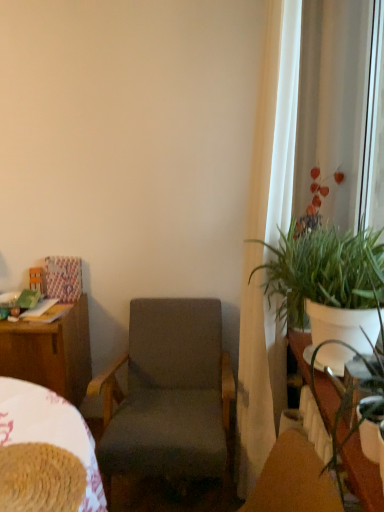
Question: Is dark gray fabric chair at center spatially inside wooden desk at left, or outside of it?

Choices:
 (A) inside
 (B) outside

Answer: (B)

Question: Does point (162, 388) appear closer or farther from the camera than point (46, 337)?

Choices:
 (A) closer
 (B) farther

Answer: (B)

Question: Estimate the real-world distances between objects in this image. Which object is farther from the dark gray fabric chair at center?

Choices:
 (A) white glossy table at right
 (B) wooden desk at left
 (C) woven fabric bed at lower left
 (D) green leafy plant at right
 (E) white sheer curtain at right

Answer: (A)

Question: Estimate the real-world distances between objects in this image. Which object is closer to the green leafy plant at right?

Choices:
 (A) dark gray fabric chair at center
 (B) white sheer curtain at right
 (C) wooden desk at left
 (D) white glossy table at right
 (E) woven fabric bed at lower left

Answer: (D)